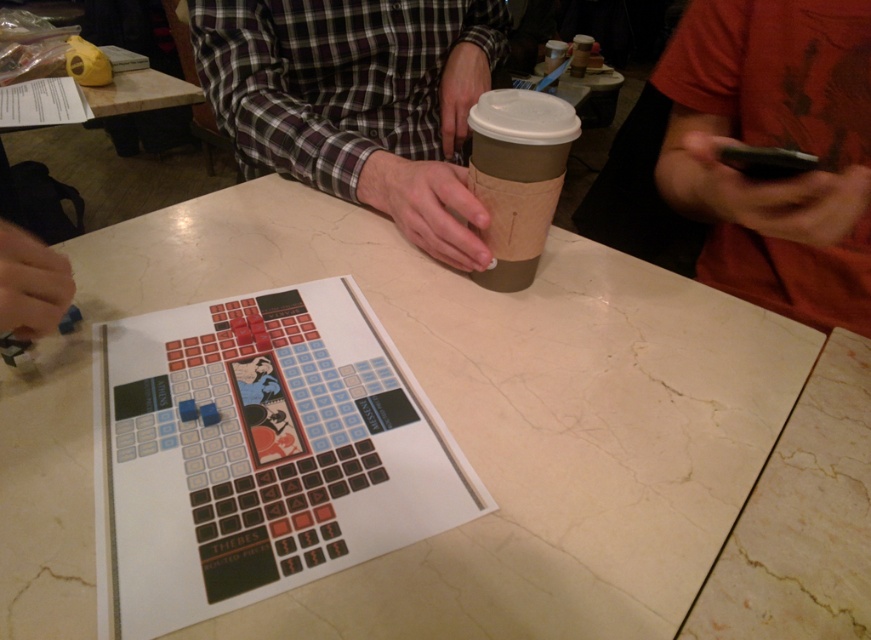
Does white marble table at center have a greater width compared to plaid shirt at center?

Correct, the width of white marble table at center exceeds that of plaid shirt at center.

Is white marble table at center bigger than plaid shirt at center?

Correct, white marble table at center is larger in size than plaid shirt at center.

Does point (179, 221) lie in front of point (437, 60)?

Yes, point (179, 221) is in front of point (437, 60).

This screenshot has width=871, height=640. What are the coordinates of `white marble table at center` in the screenshot? It's located at (446, 424).

Who is positioned more to the left, plaid shirt at center or orange cotton shirt at upper right?

From the viewer's perspective, plaid shirt at center appears more on the left side.

Who is shorter, plaid shirt at center or orange cotton shirt at upper right?

orange cotton shirt at upper right

Who is more distant from viewer, (348,61) or (849,202)?

Positioned behind is point (348,61).

Identify the location of plaid shirt at center. (356, 100).

Does white marble table at center have a greater height compared to orange cotton shirt at upper right?

Incorrect, white marble table at center's height is not larger of orange cotton shirt at upper right's.

Between point (599, 486) and point (848, 22), which one is positioned in front?

Point (599, 486) is in front.

This screenshot has width=871, height=640. What are the coordinates of `white marble table at center` in the screenshot? It's located at (446, 424).